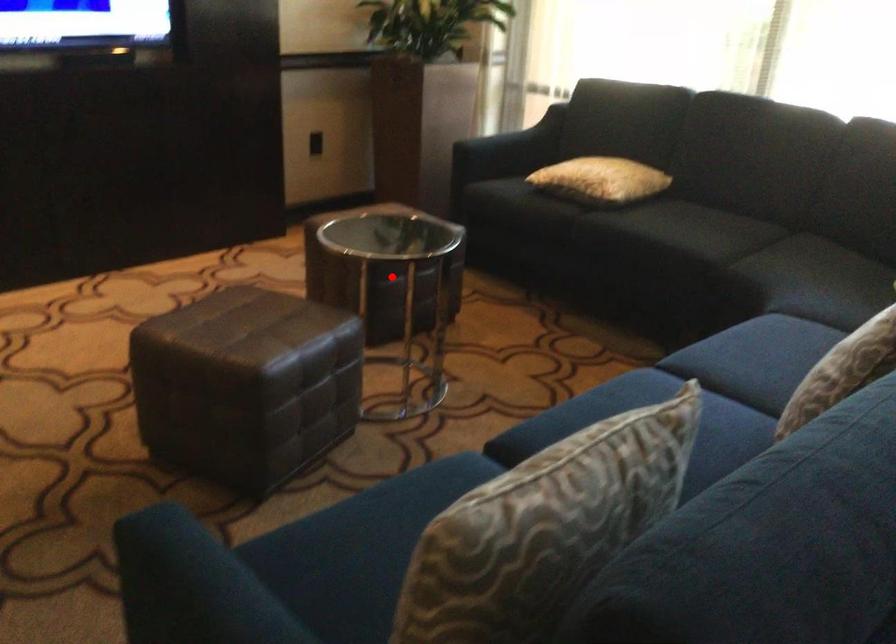
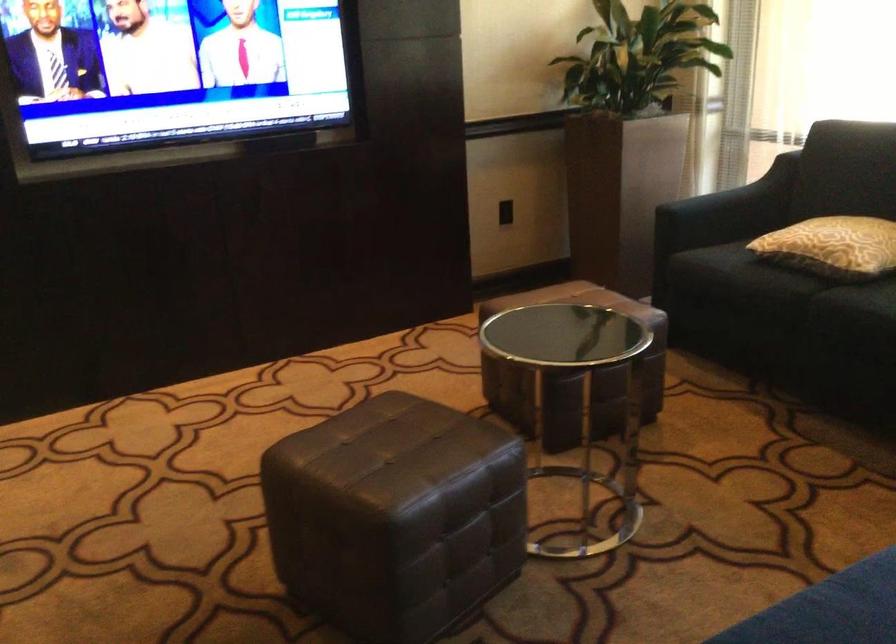
Question: A red point is marked in image1. In image2, is the corresponding 3D point closer to the camera or farther? Reply with the corresponding letter.

Choices:
 (A) The corresponding 3D point is closer.
 (B) The corresponding 3D point is farther.

Answer: (A)